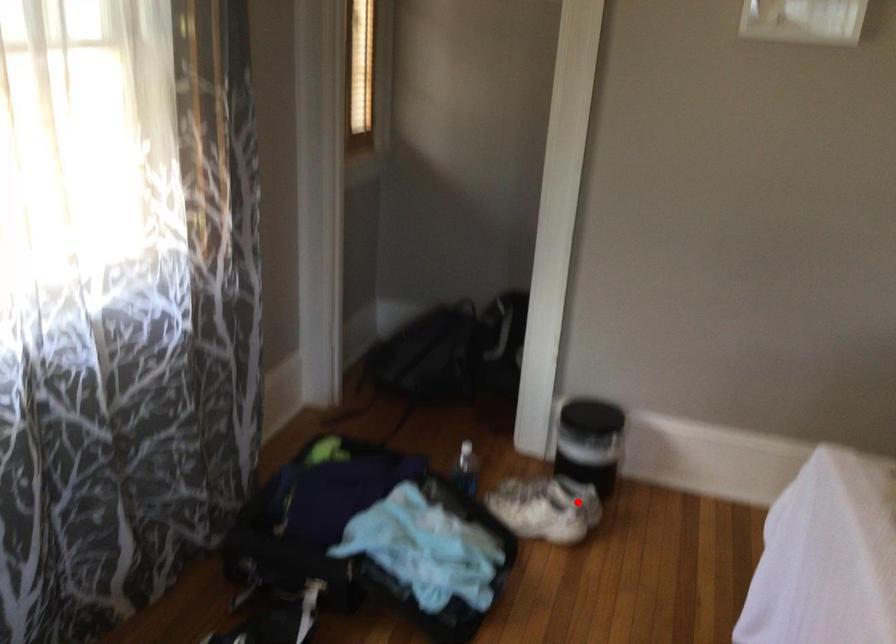
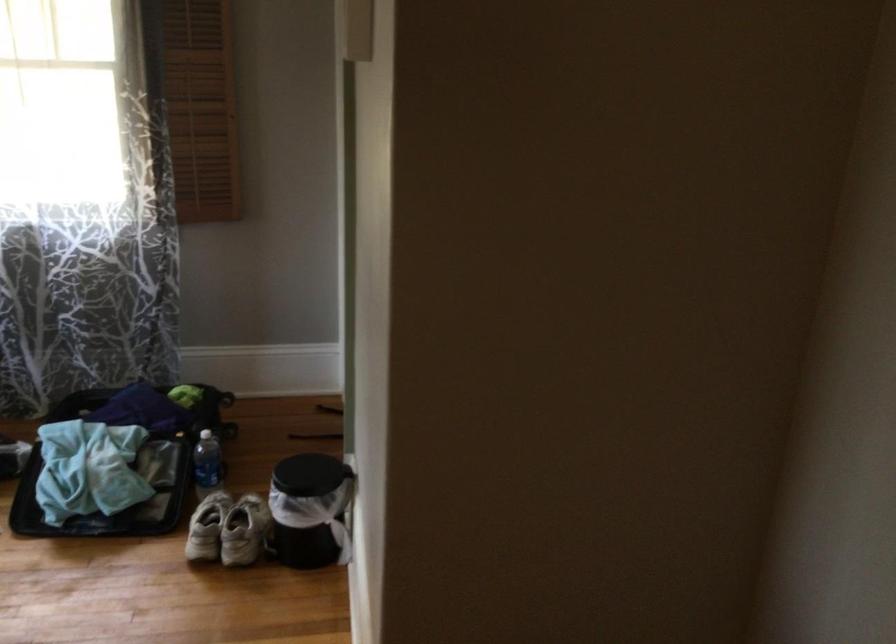
Find the pixel in the second image that matches the highlighted location in the first image.

(207, 527)